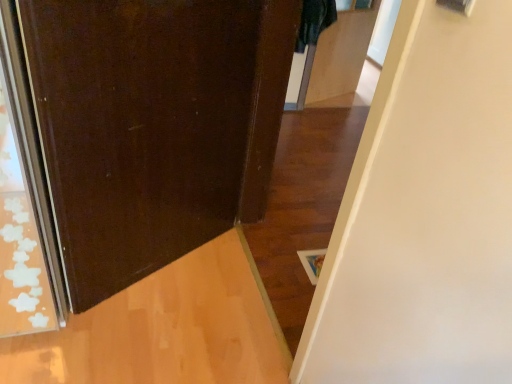
Question: Is matte brown door at left, placed as the 1th door when sorted from left to right, outside of matte brown door at center, the 2th door when ordered from left to right?

Choices:
 (A) no
 (B) yes

Answer: (B)

Question: From the image's perspective, is matte brown door at left, the second door when ordered from right to left, located above matte brown door at center, the first door positioned from the right?

Choices:
 (A) no
 (B) yes

Answer: (A)

Question: Is matte brown door at left, placed as the 1th door when sorted from left to right, in contact with matte brown door at center, the 2th door when ordered from left to right?

Choices:
 (A) no
 (B) yes

Answer: (A)

Question: From the image's perspective, is matte brown door at left, the second door when ordered from right to left, below matte brown door at center, the 2th door when ordered from left to right?

Choices:
 (A) no
 (B) yes

Answer: (B)

Question: Is matte brown door at left, the second door when ordered from right to left, shorter than matte brown door at center, the first door positioned from the right?

Choices:
 (A) yes
 (B) no

Answer: (A)

Question: Is matte brown door at left, placed as the 1th door when sorted from left to right, at the left side of matte brown door at center, the first door positioned from the right?

Choices:
 (A) no
 (B) yes

Answer: (B)

Question: Could matte brown door at left, the second door when ordered from right to left, be considered to be inside matte brown door at center, the first door positioned from the right?

Choices:
 (A) no
 (B) yes

Answer: (A)

Question: Is matte brown door at center, the 2th door when ordered from left to right, oriented away from matte brown door at left, the second door when ordered from right to left?

Choices:
 (A) no
 (B) yes

Answer: (B)

Question: From a real-world perspective, is matte brown door at center, the first door positioned from the right, under matte brown door at left, placed as the 1th door when sorted from left to right?

Choices:
 (A) yes
 (B) no

Answer: (B)

Question: From the image's perspective, is matte brown door at center, the 2th door when ordered from left to right, beneath matte brown door at left, the second door when ordered from right to left?

Choices:
 (A) yes
 (B) no

Answer: (B)

Question: Could you tell me if matte brown door at center, the 2th door when ordered from left to right, is facing matte brown door at left, the second door when ordered from right to left?

Choices:
 (A) no
 (B) yes

Answer: (B)

Question: Is matte brown door at center, the first door positioned from the right, not inside matte brown door at left, placed as the 1th door when sorted from left to right?

Choices:
 (A) yes
 (B) no

Answer: (A)

Question: Is matte brown door at left, the second door when ordered from right to left, spatially inside matte brown door at center, the first door positioned from the right, or outside of it?

Choices:
 (A) inside
 (B) outside

Answer: (B)